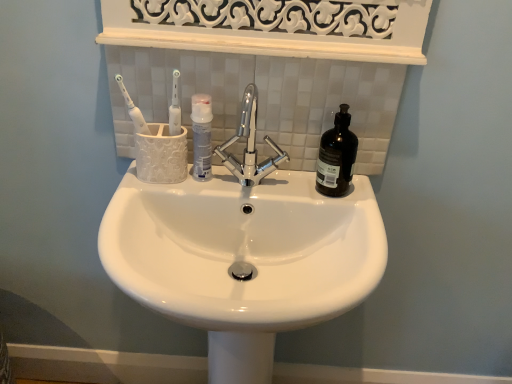
Image resolution: width=512 pixels, height=384 pixels. Find the location of `free space between black glass bottle at right, arranged as the second mouthwash when viewed from the left, and white glossy toothbrush at upper left`. free space between black glass bottle at right, arranged as the second mouthwash when viewed from the left, and white glossy toothbrush at upper left is located at coordinates (256, 179).